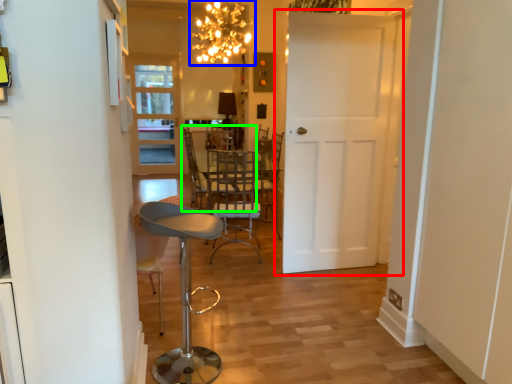
Question: Which object is the closest to the door (highlighted by a red box)? Choose among these: lamp (highlighted by a blue box) or chair (highlighted by a green box).

Choices:
 (A) lamp
 (B) chair

Answer: (B)